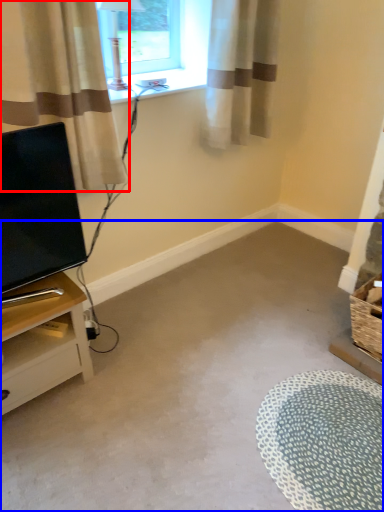
Question: Which object appears farthest to the camera in this image, curtain (highlighted by a red box) or plain (highlighted by a blue box)?

Choices:
 (A) curtain
 (B) plain

Answer: (A)